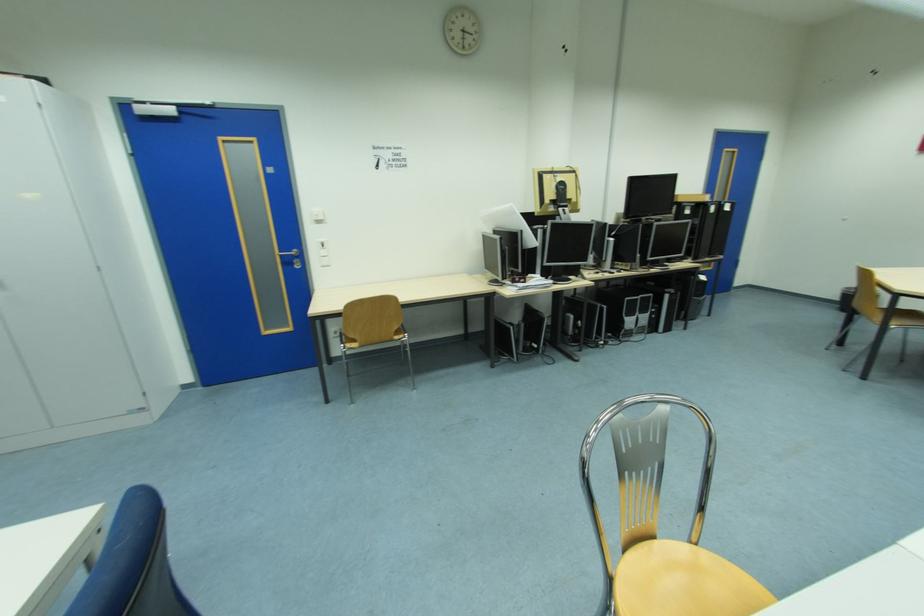
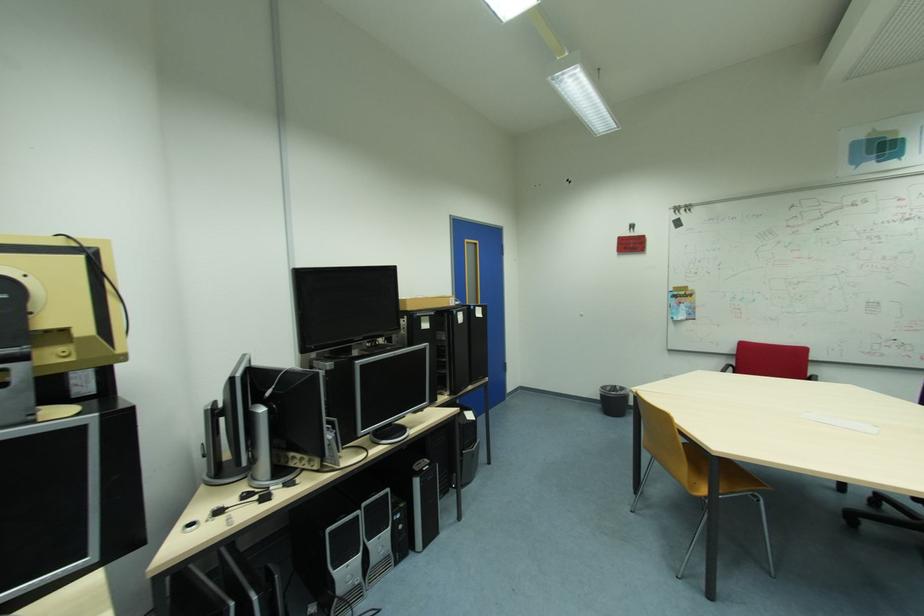
The point at (575, 169) is marked in the first image. Where is the corresponding point in the second image?

(66, 244)